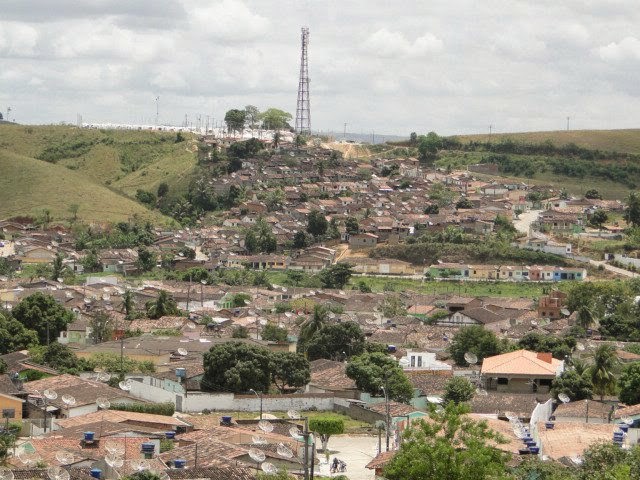
Where is `white wall`? This screenshot has height=480, width=640. white wall is located at coordinates (210, 402), (159, 395), (305, 402), (628, 260).